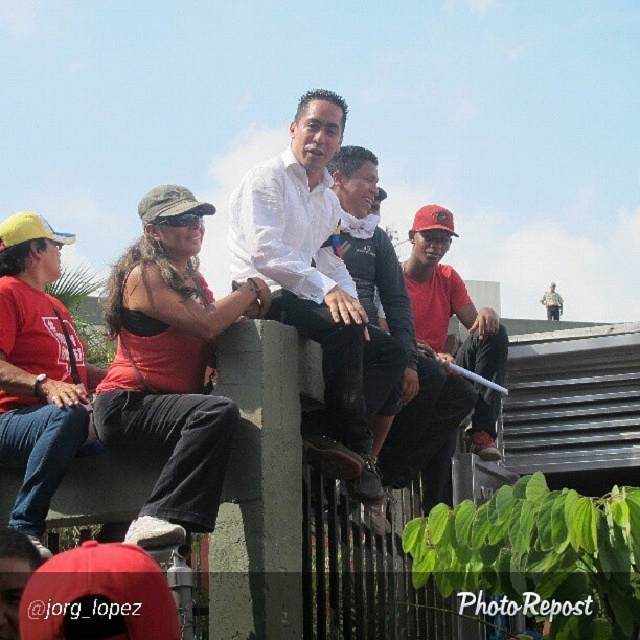
You are a photographer trying to capture a group photo of the matte red shirt at left and the matte black shirt at center. Since you want to ensure both subjects are framed properly, which person should you position closer to the front of the frame?

The matte red shirt at left should be positioned closer to the front of the frame because it has a lesser height compared to the matte black shirt at center, ensuring both are framed properly.

You are standing in front of the scene and want to take a photo of the white cotton shirt at center. Where should you aim your camera to capture it?

To capture the white cotton shirt at center, aim your camera at the coordinates point (307, 260).